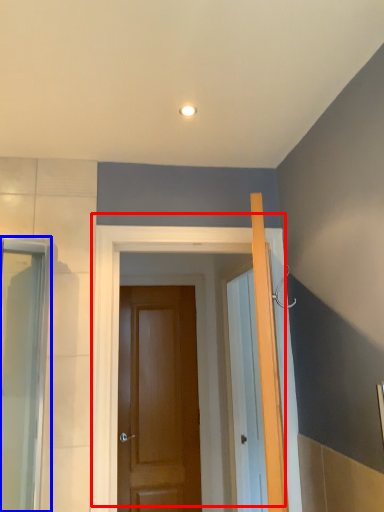
Question: Which object is closer to the camera taking this photo, door (highlighted by a red box) or screen door (highlighted by a blue box)?

Choices:
 (A) door
 (B) screen door

Answer: (B)